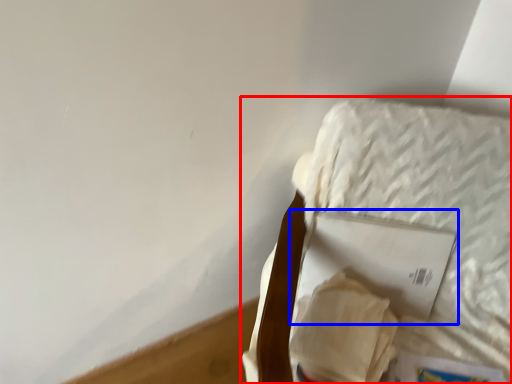
Question: Which of the following is the farthest to the observer, furniture (highlighted by a red box) or paperback book (highlighted by a blue box)?

Choices:
 (A) furniture
 (B) paperback book

Answer: (B)